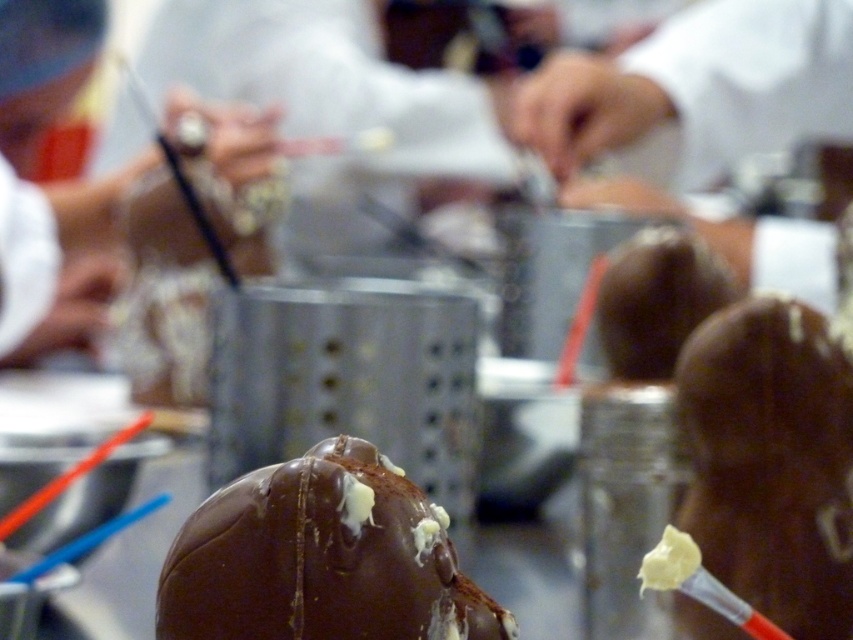
You are a food inspector examining the table with both the shiny chocolate candy at center and the shiny chocolate truffle at center. Which item is smaller in width?

The shiny chocolate candy at center has a lesser width compared to the shiny chocolate truffle at center, so the shiny chocolate candy at center is smaller in width.